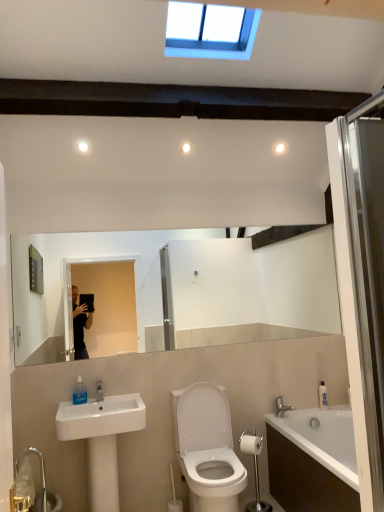
Question: From the image's perspective, is white glossy toilet at center located beneath white glossy bathtub at lower right?

Choices:
 (A) no
 (B) yes

Answer: (A)

Question: From a real-world perspective, does white glossy toilet at center stand above white glossy bathtub at lower right?

Choices:
 (A) no
 (B) yes

Answer: (B)

Question: Is white glossy bathtub at lower right at the back of white glossy toilet at center?

Choices:
 (A) yes
 (B) no

Answer: (B)

Question: Can you confirm if white glossy toilet at center is smaller than white glossy bathtub at lower right?

Choices:
 (A) yes
 (B) no

Answer: (A)

Question: Does white glossy toilet at center have a larger size compared to white glossy bathtub at lower right?

Choices:
 (A) yes
 (B) no

Answer: (B)

Question: Could you tell me if white glossy toilet at center is facing white glossy bathtub at lower right?

Choices:
 (A) no
 (B) yes

Answer: (A)

Question: From the image's perspective, is silver metallic faucet at lower right above blue plastic window at upper center?

Choices:
 (A) no
 (B) yes

Answer: (A)

Question: Is silver metallic faucet at lower right outside of blue plastic window at upper center?

Choices:
 (A) yes
 (B) no

Answer: (A)

Question: From a real-world perspective, is silver metallic faucet at lower right positioned over blue plastic window at upper center based on gravity?

Choices:
 (A) no
 (B) yes

Answer: (A)

Question: Is silver metallic faucet at lower right behind blue plastic window at upper center?

Choices:
 (A) yes
 (B) no

Answer: (A)

Question: Can you confirm if silver metallic faucet at lower right is bigger than blue plastic window at upper center?

Choices:
 (A) no
 (B) yes

Answer: (A)

Question: Considering the relative sizes of silver metallic faucet at lower right and blue plastic window at upper center in the image provided, is silver metallic faucet at lower right smaller than blue plastic window at upper center?

Choices:
 (A) yes
 (B) no

Answer: (A)

Question: Considering the relative positions of transparent glass shower door at right and white glossy sink at lower left in the image provided, is transparent glass shower door at right to the right of white glossy sink at lower left from the viewer's perspective?

Choices:
 (A) yes
 (B) no

Answer: (A)